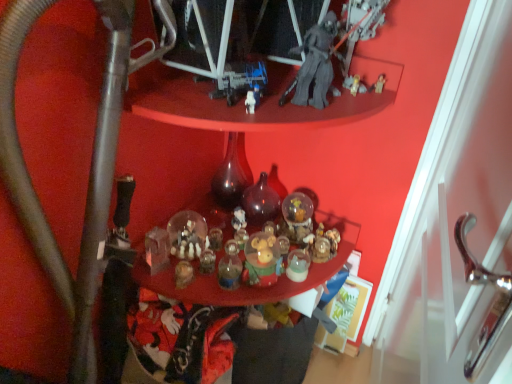
Question: Based on their sizes in the image, would you say translucent glass bottle at center, placed as the 2th bottle when sorted from right to left, is bigger or smaller than metallic gray water pipe at lower left?

Choices:
 (A) small
 (B) big

Answer: (A)

Question: Based on their positions, is translucent glass bottle at center, which is the first bottle in left-to-right order, located to the left or right of metallic gray water pipe at lower left?

Choices:
 (A) left
 (B) right

Answer: (B)

Question: Estimate the real-world distances between objects in this image. Which object is closer to the translucent glass bottle at center, which is the first bottle in left-to-right order?

Choices:
 (A) translucent glass ornaments at center
 (B) translucent dark glass bottle at center, positioned as the second bottle in left-to-right order
 (C) metallic gray water pipe at lower left

Answer: (B)

Question: Considering the real-world distances, which object is farthest from the translucent glass bottle at center, placed as the 2th bottle when sorted from right to left?

Choices:
 (A) translucent glass ornaments at center
 (B) metallic gray water pipe at lower left
 (C) translucent dark glass bottle at center, placed as the 1th bottle when sorted from right to left

Answer: (B)